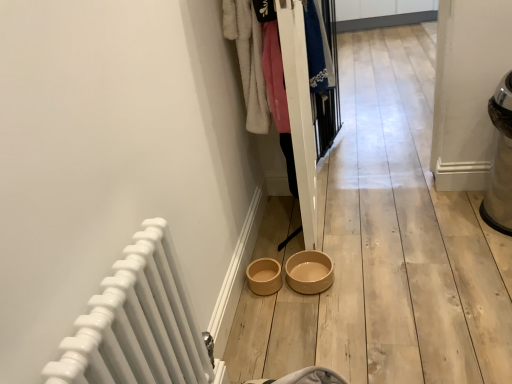
Question: Is blue cotton shirt at center, the 2th clothing positioned from the left, to the right of white glossy radiator at lower left from the viewer's perspective?

Choices:
 (A) yes
 (B) no

Answer: (A)

Question: From the image's perspective, does blue cotton shirt at center, which ranks as the first clothing in right-to-left order, appear higher than white glossy radiator at lower left?

Choices:
 (A) no
 (B) yes

Answer: (B)

Question: Is blue cotton shirt at center, the 2th clothing positioned from the left, outside of white glossy radiator at lower left?

Choices:
 (A) yes
 (B) no

Answer: (A)

Question: From the image's perspective, does blue cotton shirt at center, which ranks as the first clothing in right-to-left order, appear lower than white glossy radiator at lower left?

Choices:
 (A) no
 (B) yes

Answer: (A)

Question: Is blue cotton shirt at center, arranged as the second clothing when viewed from the front, at the left side of white glossy radiator at lower left?

Choices:
 (A) no
 (B) yes

Answer: (A)

Question: Which is correct: beige ceramic bowl at center is inside blue cotton shirt at center, the 2th clothing positioned from the left, or outside of it?

Choices:
 (A) inside
 (B) outside

Answer: (B)

Question: Looking at their shapes, would you say beige ceramic bowl at center is wider or thinner than blue cotton shirt at center, which ranks as the first clothing in right-to-left order?

Choices:
 (A) wide
 (B) thin

Answer: (A)

Question: Is point (324, 253) positioned closer to the camera than point (303, 1)?

Choices:
 (A) farther
 (B) closer

Answer: (A)

Question: In terms of height, does beige ceramic bowl at center look taller or shorter compared to blue cotton shirt at center, arranged as the second clothing when viewed from the front?

Choices:
 (A) tall
 (B) short

Answer: (B)

Question: Is blue cotton shirt at center, which is the 1th clothing in back-to-front order, inside the boundaries of white wooden closet at center, or outside?

Choices:
 (A) outside
 (B) inside

Answer: (A)

Question: Is blue cotton shirt at center, which is the 1th clothing in back-to-front order, wider or thinner than white wooden closet at center?

Choices:
 (A) wide
 (B) thin

Answer: (B)

Question: From a real-world perspective, is blue cotton shirt at center, the 2th clothing positioned from the left, positioned above or below white wooden closet at center?

Choices:
 (A) below
 (B) above

Answer: (B)

Question: From the image's perspective, is blue cotton shirt at center, the 2th clothing positioned from the left, positioned above or below white wooden closet at center?

Choices:
 (A) above
 (B) below

Answer: (A)

Question: Is beige ceramic bowl at center in front of or behind white fluffy coat at upper center, the first clothing positioned from the front, in the image?

Choices:
 (A) behind
 (B) front

Answer: (A)

Question: Considering the positions of beige ceramic bowl at center and white fluffy coat at upper center, the first clothing positioned from the front, in the image, is beige ceramic bowl at center taller or shorter than white fluffy coat at upper center, the first clothing positioned from the front,?

Choices:
 (A) tall
 (B) short

Answer: (B)